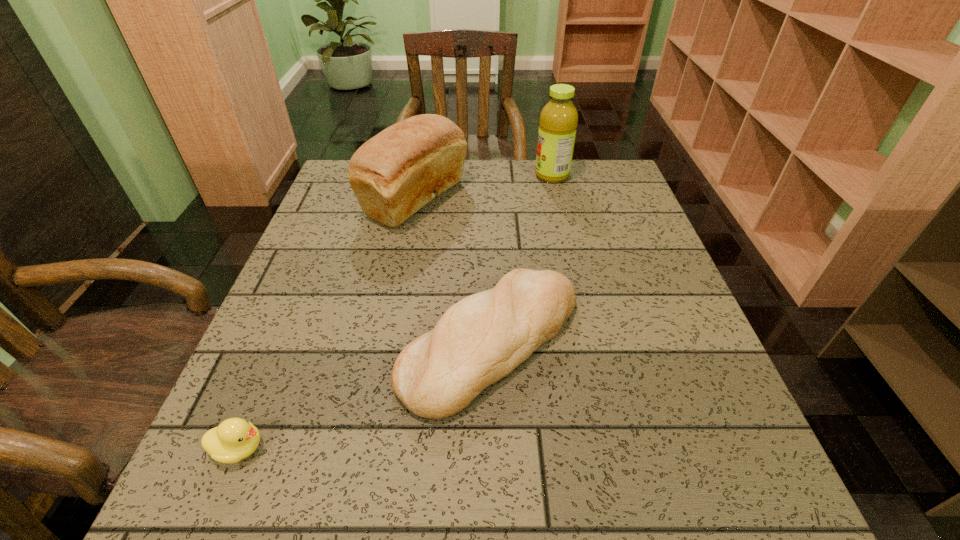
Locate an element on the screen. The width and height of the screenshot is (960, 540). vacant point located on the left of the third shortest object is located at coordinates (342, 199).

Locate an element on the screen. The image size is (960, 540). vacant space situated 0.170m on the right of the nearer bread is located at coordinates [x=674, y=343].

The height and width of the screenshot is (540, 960). Find the location of `vacant area located 0.400m on the beak of the nearest object`. vacant area located 0.400m on the beak of the nearest object is located at coordinates (528, 448).

Identify the location of fruit juice that is at the far edge. (558, 121).

Image resolution: width=960 pixels, height=540 pixels. I want to click on bread that is positioned at the far edge, so click(x=394, y=174).

Where is `object situated at the near edge`? Image resolution: width=960 pixels, height=540 pixels. object situated at the near edge is located at coordinates pyautogui.click(x=235, y=439).

You are a GUI agent. You are given a task and a screenshot of the screen. Output one action in this format:
    pyautogui.click(x=<x>, y=<y>)
    Task: Click on the bread located in the left edge section of the desktop
    The image size is (960, 540).
    Given the screenshot: What is the action you would take?
    pyautogui.click(x=394, y=174)

Where is `duckling located at the left edge`? Image resolution: width=960 pixels, height=540 pixels. duckling located at the left edge is located at coordinates (235, 439).

Find the location of a particular element. The height and width of the screenshot is (540, 960). object that is at the right edge is located at coordinates (558, 121).

Locate an element on the screen. The height and width of the screenshot is (540, 960). object present at the far left corner is located at coordinates (394, 174).